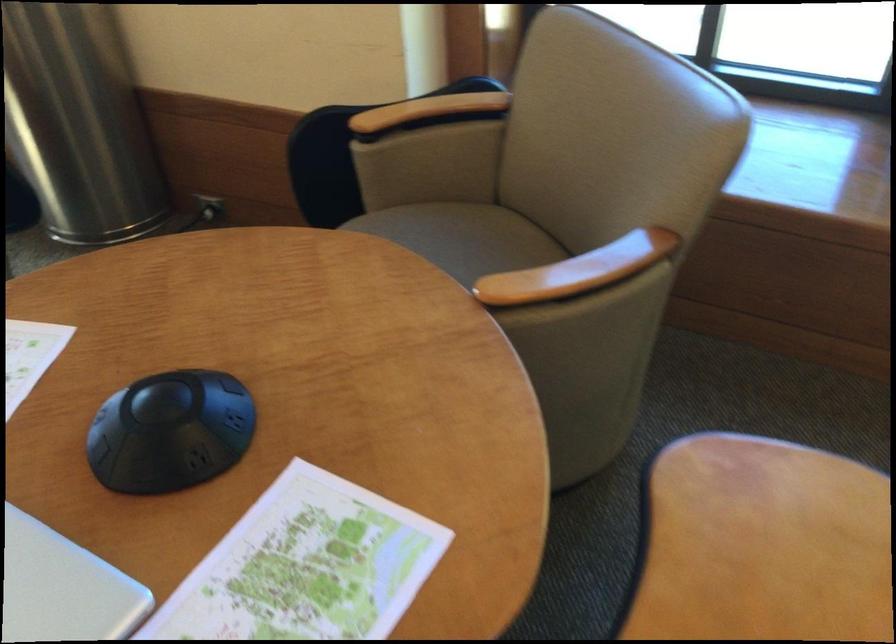
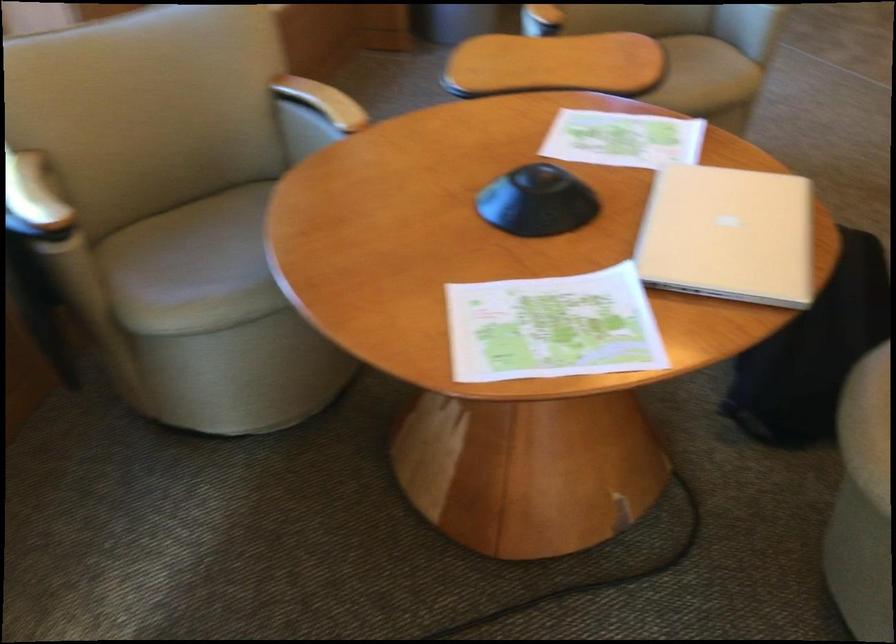
Locate, in the second image, the point that corresponds to point 107,505 in the first image.

(537, 202)